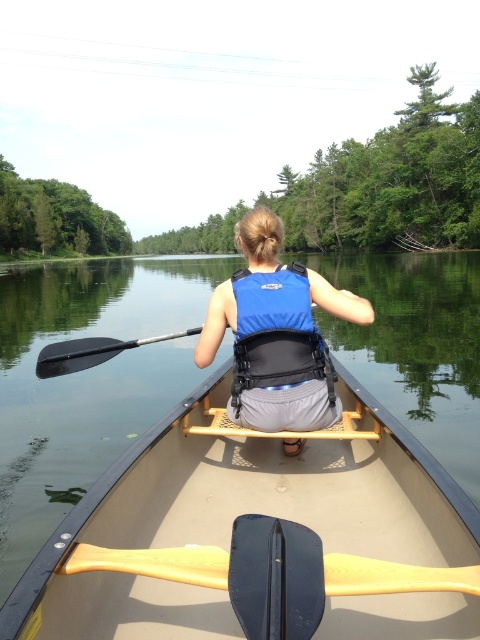
Is point (232, 451) positioned in front of point (259, 369)?

That is False.

The width and height of the screenshot is (480, 640). In order to click on tan plastic canoe at center in this screenshot , I will do `click(265, 516)`.

Which is in front, point (248, 433) or point (358, 323)?

Point (248, 433) is more forward.

In order to click on tan plastic canoe at center in this screenshot , I will do `click(265, 516)`.

Between blue fabric life vest at center and wooden paddle at center, which one is positioned lower?

Positioned lower is wooden paddle at center.

Between point (213, 300) and point (87, 545), which one is positioned behind?

Point (213, 300)

Describe the element at coordinates (276, 333) in the screenshot. I see `blue fabric life vest at center` at that location.

Where is `blue fabric life vest at center`? blue fabric life vest at center is located at coordinates (276, 333).

Can you confirm if tan plastic canoe at center is positioned to the left of wooden paddle at center?

In fact, tan plastic canoe at center is to the right of wooden paddle at center.

Which is more to the left, tan plastic canoe at center or wooden paddle at center?

wooden paddle at center

Between point (404, 468) and point (180, 561), which one is positioned behind?

The point (404, 468) is more distant.

The image size is (480, 640). I want to click on tan plastic canoe at center, so click(265, 516).